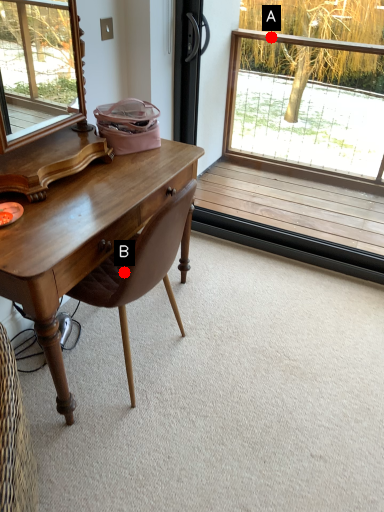
Question: Two points are circled on the image, labeled by A and B beside each circle. Which point is farther from the camera taking this photo?

Choices:
 (A) A is further
 (B) B is further

Answer: (A)